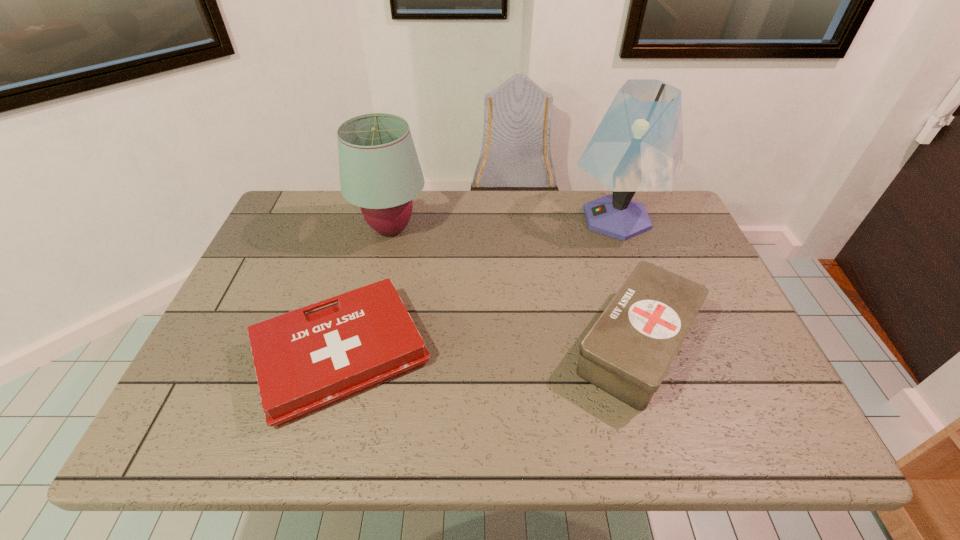
The height and width of the screenshot is (540, 960). What are the coordinates of `blank region between the taller lampshade and the shortest object` in the screenshot? It's located at (479, 286).

Locate an element on the screen. vacant space that's between the right lampshade and the shortest object is located at coordinates (479, 286).

Find the location of `free point between the left lampshade and the taller lampshade`. free point between the left lampshade and the taller lampshade is located at coordinates 504,224.

Find the location of a particular element. The width and height of the screenshot is (960, 540). free space between the taller first-aid kit and the shorter lampshade is located at coordinates (514, 287).

The image size is (960, 540). Find the location of `the second closest object relative to the shorter lampshade`. the second closest object relative to the shorter lampshade is located at coordinates (628, 351).

What are the coordinates of `object that is the second closest to the taller first-aid kit` in the screenshot? It's located at (304, 362).

Locate an element on the screen. free location that satisfies the following two spatial constraints: 1. on the back side of the shorter first-aid kit; 2. on the left side of the taller first-aid kit is located at coordinates (344, 344).

This screenshot has height=540, width=960. Identify the location of vacant area that satisfies the following two spatial constraints: 1. on the front side of the second tallest object; 2. on the left side of the third tallest object. (365, 344).

Locate an element on the screen. This screenshot has width=960, height=540. free space that satisfies the following two spatial constraints: 1. on the base of the taller lampshade; 2. on the front side of the third shortest object is located at coordinates (620, 229).